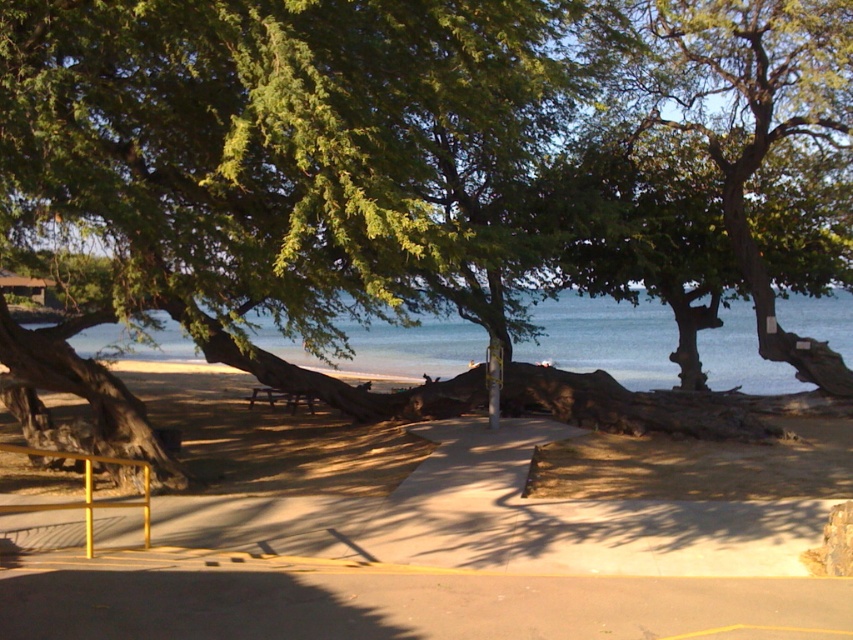
Looking at this image, is blue water at center taller than wooden picnic table at center?

Yes.

Does blue water at center appear on the right side of wooden picnic table at center?

Incorrect, blue water at center is not on the right side of wooden picnic table at center.

Is point (172, 342) positioned before point (281, 392)?

No, it is behind (281, 392).

You are a GUI agent. You are given a task and a screenshot of the screen. Output one action in this format:
    pyautogui.click(x=<x>, y=<y>)
    Task: Click on the blue water at center
    The image size is (853, 640).
    Given the screenshot: What is the action you would take?
    click(x=605, y=339)

Between beige sand at lower center and blue water at center, which one appears on the left side from the viewer's perspective?

blue water at center

Is beige sand at lower center shorter than blue water at center?

Yes, beige sand at lower center is shorter than blue water at center.

Between point (701, 536) and point (428, 326), which one is positioned in front?

Point (701, 536) is in front.

Locate an element on the screen. beige sand at lower center is located at coordinates (422, 538).

Looking at this image, does green leafy tree at center appear on the right side of blue water at center?

Indeed, green leafy tree at center is positioned on the right side of blue water at center.

Which is above, green leafy tree at center or blue water at center?

green leafy tree at center

Which is behind, point (94, 4) or point (341, 324)?

Positioned behind is point (341, 324).

I want to click on green leafy tree at center, so click(x=267, y=172).